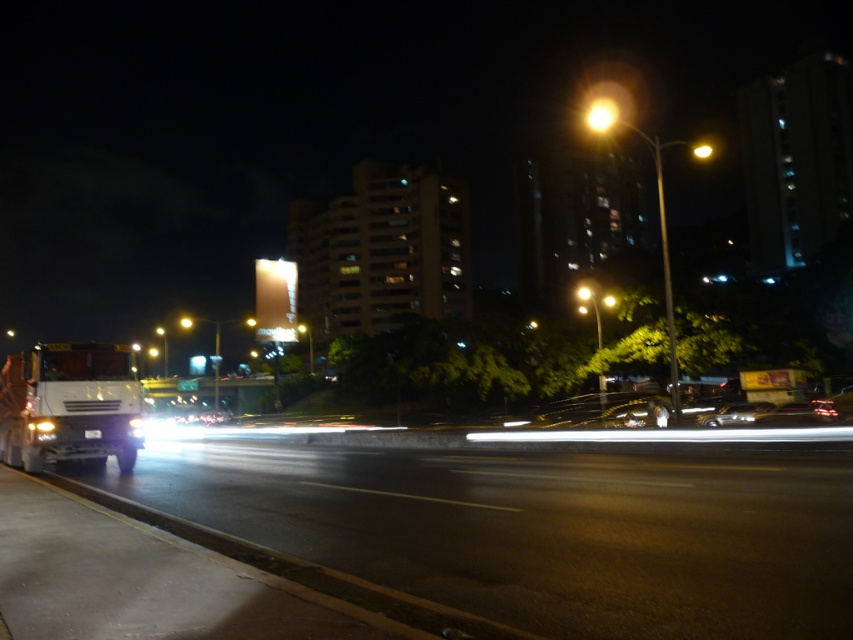
You are a delivery driver who needs to park your vehicle in a garage that has a height restriction of 2 meters. You have two options to choose from in the image. Which vehicle, the metallic silver trailer truck at left or the shiny silver car at center, is more likely to exceed the height limit?

The metallic silver trailer truck at left is taller than the shiny silver car at center, so it is more likely to exceed the height limit of 2 meters.

You are a pedestrian waiting to cross the road. You see a metallic silver trailer truck at left and a shiny silver car at center. Which vehicle is closer to the left edge of the road?

The metallic silver trailer truck at left is closer to the left edge of the road because it is positioned on the left side of the shiny silver car at center.